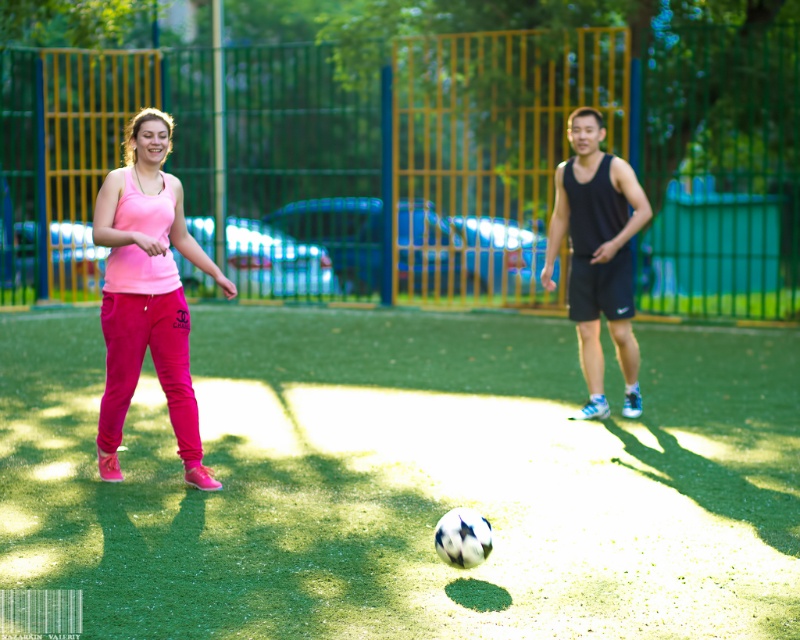
Question: Which of the following is the farthest from the observer?

Choices:
 (A) pink fabric pants at left
 (B) green artificial turf at center

Answer: (A)

Question: Does green artificial turf at center appear on the right side of pink fabric pants at left?

Choices:
 (A) yes
 (B) no

Answer: (A)

Question: Which point is farther from the camera taking this photo?

Choices:
 (A) (644, 593)
 (B) (114, 364)

Answer: (B)

Question: Is green artificial turf at center positioned in front of pink fabric pants at left?

Choices:
 (A) yes
 (B) no

Answer: (A)

Question: Is green artificial turf at center bigger than pink fabric pants at left?

Choices:
 (A) yes
 (B) no

Answer: (A)

Question: Which point is closer to the camera?

Choices:
 (A) (193, 403)
 (B) (508, 573)

Answer: (B)